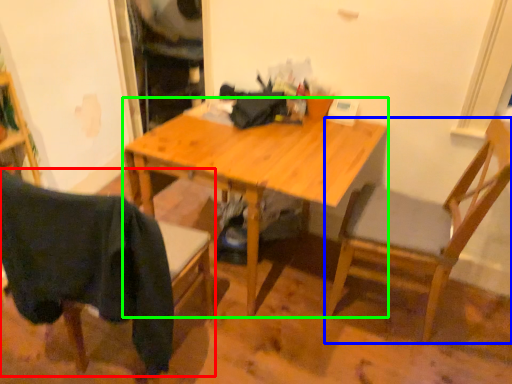
Question: Estimate the real-world distances between objects in this image. Which object is farther from chair (highlighted by a red box), chair (highlighted by a blue box) or desk (highlighted by a green box)?

Choices:
 (A) chair
 (B) desk

Answer: (A)